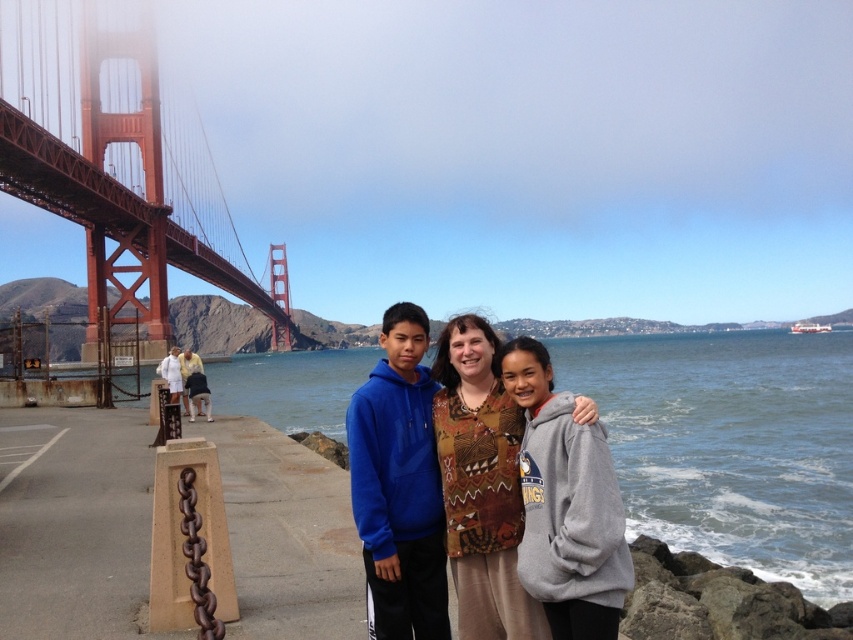
Question: Is red painted steel golden gate bridge at left positioned at the back of brown textured blouse at center?

Choices:
 (A) no
 (B) yes

Answer: (B)

Question: Among these objects, which one is farthest from the camera?

Choices:
 (A) blue water at center
 (B) white cotton shirt at left
 (C) brown textured blouse at center
 (D) red painted steel golden gate bridge at left

Answer: (D)

Question: Which object is closer to the camera taking this photo?

Choices:
 (A) blue water at center
 (B) brown textured blouse at center

Answer: (B)

Question: Does red painted steel golden gate bridge at left appear on the right side of white cotton shirt at left?

Choices:
 (A) yes
 (B) no

Answer: (B)

Question: Which point is farther from the camera taking this photo?

Choices:
 (A) (209, 406)
 (B) (479, 636)
 (C) (119, 332)
 (D) (753, 388)

Answer: (D)

Question: Is blue water at center below brown textured blouse at center?

Choices:
 (A) yes
 (B) no

Answer: (A)